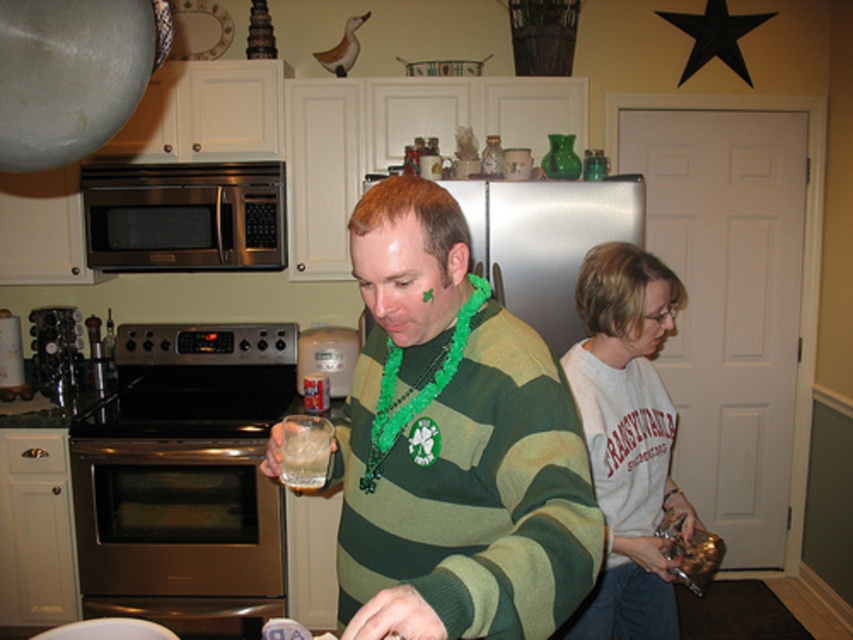
In the kitchen scene, there is a green matte sweater at center and a stainless steel microwave at upper left. Which object is narrower when viewed from the front?

The green matte sweater at center is narrower than the stainless steel microwave at upper left when viewed from the front.

You are standing in the kitchen and want to reach the point at coordinates (x=354, y=520). If your arm can extend 1.2 meters, will you be able to reach it?

The distance between the point at coordinates (x=354, y=520) and the camera is 1.36 meters. Since your arm can only extend 1.2 meters, you will not be able to reach it.

You are a home decorator planning to place a new decorative item between the green matte sweater at center and the stainless steel microwave at upper left. Based on their sizes, which object should the decorative item be placed closer to?

The decorative item should be placed closer to the stainless steel microwave at upper left because the green matte sweater at center is much taller, so the microwave is shorter and the space between them would require the item to be near the shorter object to balance the height difference.